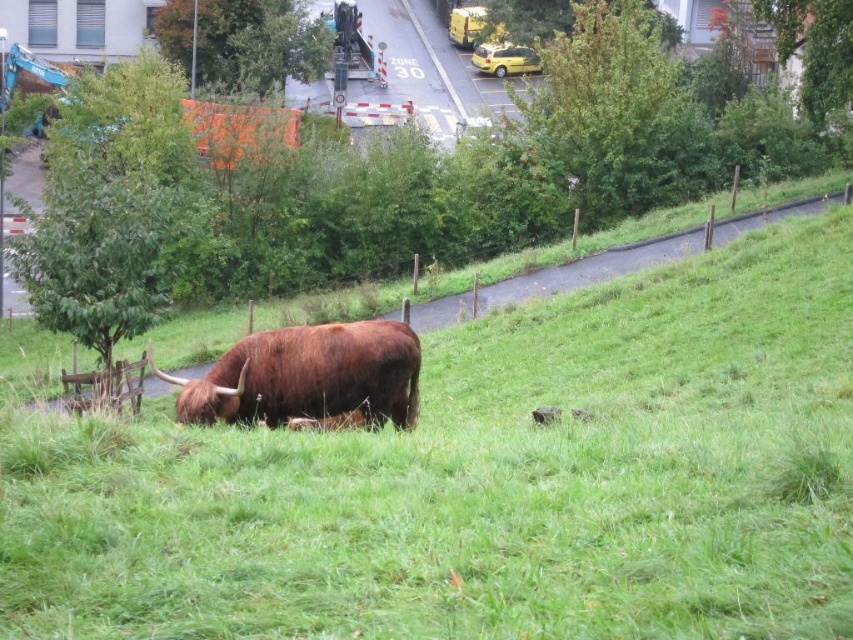
This screenshot has height=640, width=853. Find the location of `green grassy at center`. green grassy at center is located at coordinates (488, 481).

Is green grassy at center below brown furry bull at center?

Actually, green grassy at center is above brown furry bull at center.

Does point (345, 449) come farther from viewer compared to point (288, 328)?

No, (345, 449) is closer to viewer.

The image size is (853, 640). I want to click on green grassy at center, so click(x=488, y=481).